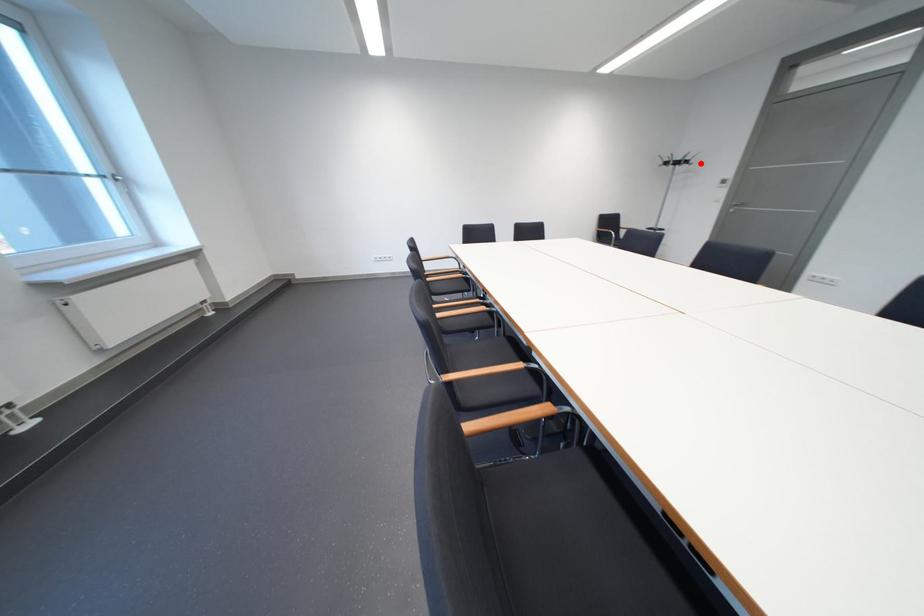
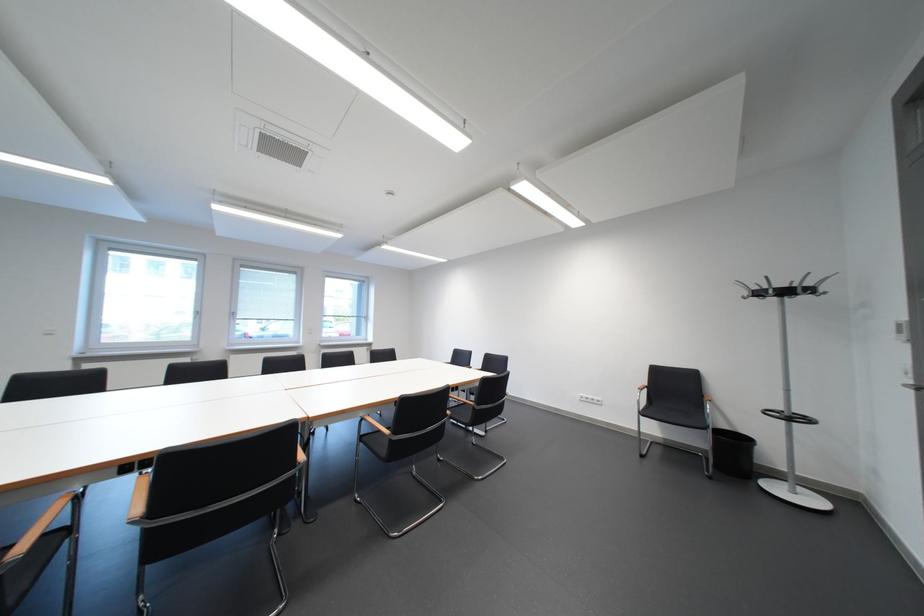
Find the pixel in the second image that matches the highlighted location in the first image.

(823, 292)